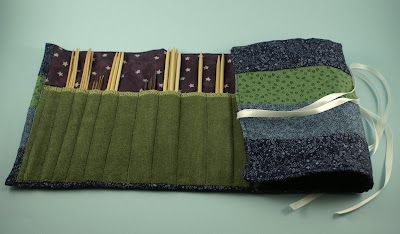
You are a GUI agent. You are given a task and a screenshot of the screen. Output one action in this format:
    pyautogui.click(x=<x>, y=<y>)
    Task: Click on the light, gray-blue table
    This screenshot has height=234, width=400.
    Given the screenshot: What is the action you would take?
    pyautogui.click(x=151, y=26)